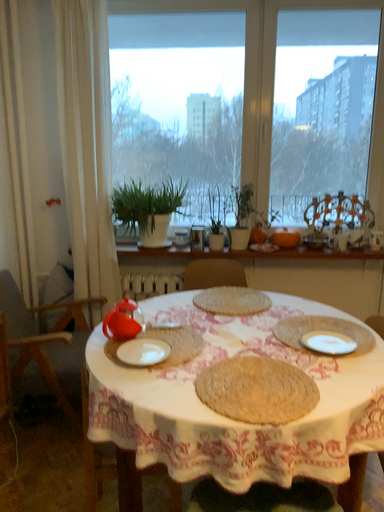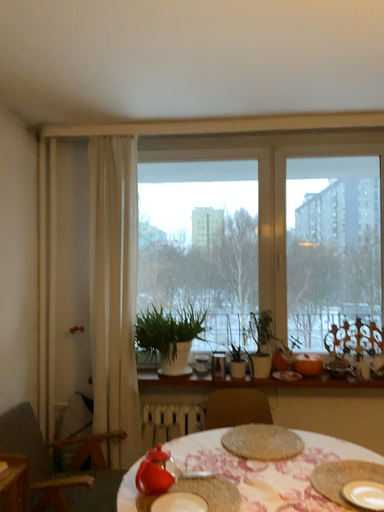
Question: How did the camera likely rotate when shooting the video?

Choices:
 (A) rotated downward
 (B) rotated upward

Answer: (B)